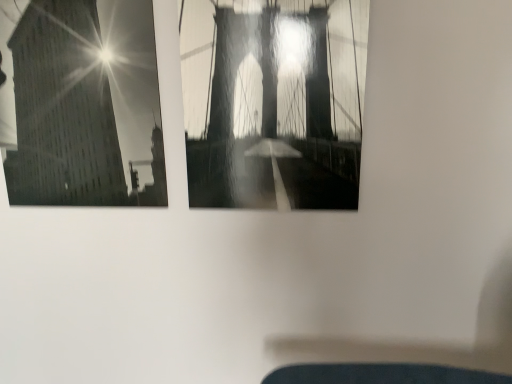
This screenshot has width=512, height=384. What do you see at coordinates (273, 102) in the screenshot? I see `metallic bridge at center, the second window in the left-to-right sequence` at bounding box center [273, 102].

Based on the photo, measure the distance between point (272, 197) and camera.

Point (272, 197) and camera are 95.60 centimeters apart.

Identify the location of metallic bridge at center, marked as the 1th window in a right-to-left arrangement. The height and width of the screenshot is (384, 512). (273, 102).

The height and width of the screenshot is (384, 512). What are the coordinates of `smooth glass building at upper left, the 1th window in the left-to-right sequence` in the screenshot? It's located at (86, 106).

Measure the distance between smooth glass building at upper left, which appears as the second window when viewed from the right, and camera.

34.37 inches.

How much space does smooth glass building at upper left, the 1th window in the left-to-right sequence, occupy horizontally?

The width of smooth glass building at upper left, the 1th window in the left-to-right sequence, is 2.05 inches.

What do you see at coordinates (86, 106) in the screenshot?
I see `smooth glass building at upper left, the 1th window in the left-to-right sequence` at bounding box center [86, 106].

At what (x,y) coordinates should I click in order to perform the action: click on metallic bridge at center, marked as the 1th window in a right-to-left arrangement. Please return your answer as a coordinate pair (x, y). The height and width of the screenshot is (384, 512). Looking at the image, I should click on (273, 102).

Based on the photo, which object is positioned more to the left, smooth glass building at upper left, which appears as the second window when viewed from the right, or metallic bridge at center, marked as the 1th window in a right-to-left arrangement?

smooth glass building at upper left, which appears as the second window when viewed from the right.

Is smooth glass building at upper left, the 1th window in the left-to-right sequence, closer to camera compared to metallic bridge at center, the second window in the left-to-right sequence?

No, it is behind metallic bridge at center, the second window in the left-to-right sequence.

Is point (116, 29) closer to camera compared to point (243, 135)?

Yes, point (116, 29) is in front of point (243, 135).

From the image's perspective, is smooth glass building at upper left, which appears as the second window when viewed from the right, on top of metallic bridge at center, the second window in the left-to-right sequence?

Yes, from the image's perspective, smooth glass building at upper left, which appears as the second window when viewed from the right, is on top of metallic bridge at center, the second window in the left-to-right sequence.

From a real-world perspective, is smooth glass building at upper left, which appears as the second window when viewed from the right, positioned above or below metallic bridge at center, marked as the 1th window in a right-to-left arrangement?

From a real-world perspective, smooth glass building at upper left, which appears as the second window when viewed from the right, is physically above metallic bridge at center, marked as the 1th window in a right-to-left arrangement.

Does smooth glass building at upper left, which appears as the second window when viewed from the right, have a lesser width compared to metallic bridge at center, the second window in the left-to-right sequence?

Yes.

Considering the relative sizes of smooth glass building at upper left, the 1th window in the left-to-right sequence, and metallic bridge at center, the second window in the left-to-right sequence, in the image provided, is smooth glass building at upper left, the 1th window in the left-to-right sequence, taller than metallic bridge at center, the second window in the left-to-right sequence,?

Yes.

Which of these two, smooth glass building at upper left, which appears as the second window when viewed from the right, or metallic bridge at center, marked as the 1th window in a right-to-left arrangement, is bigger?

smooth glass building at upper left, which appears as the second window when viewed from the right.

Based on the photo, is metallic bridge at center, the second window in the left-to-right sequence, completely or partially inside smooth glass building at upper left, which appears as the second window when viewed from the right?

Definitely not — metallic bridge at center, the second window in the left-to-right sequence, is not inside smooth glass building at upper left, which appears as the second window when viewed from the right.

Is smooth glass building at upper left, which appears as the second window when viewed from the right, in contact with metallic bridge at center, the second window in the left-to-right sequence?

No, smooth glass building at upper left, which appears as the second window when viewed from the right, is not touching metallic bridge at center, the second window in the left-to-right sequence.

Is smooth glass building at upper left, the 1th window in the left-to-right sequence, turned away from metallic bridge at center, the second window in the left-to-right sequence?

That's not correct — smooth glass building at upper left, the 1th window in the left-to-right sequence, is not looking away from metallic bridge at center, the second window in the left-to-right sequence.

Can you tell me how much smooth glass building at upper left, which appears as the second window when viewed from the right, and metallic bridge at center, marked as the 1th window in a right-to-left arrangement, differ in facing direction?

0.00226 degrees separate the facing orientations of smooth glass building at upper left, which appears as the second window when viewed from the right, and metallic bridge at center, marked as the 1th window in a right-to-left arrangement.

The height and width of the screenshot is (384, 512). Find the location of `window above the metallic bridge at center, marked as the 1th window in a right-to-left arrangement (from the image's perspective)`. window above the metallic bridge at center, marked as the 1th window in a right-to-left arrangement (from the image's perspective) is located at coordinates (86, 106).

Can you confirm if metallic bridge at center, the second window in the left-to-right sequence, is positioned to the left of smooth glass building at upper left, the 1th window in the left-to-right sequence?

Incorrect, metallic bridge at center, the second window in the left-to-right sequence, is not on the left side of smooth glass building at upper left, the 1th window in the left-to-right sequence.

Is the depth of metallic bridge at center, the second window in the left-to-right sequence, less than that of smooth glass building at upper left, which appears as the second window when viewed from the right?

Yes, it is.

Is point (352, 136) farther from camera compared to point (159, 159)?

No, (352, 136) is in front of (159, 159).

From the image's perspective, between metallic bridge at center, marked as the 1th window in a right-to-left arrangement, and smooth glass building at upper left, which appears as the second window when viewed from the right, which one is located above?

From the image's view, smooth glass building at upper left, which appears as the second window when viewed from the right, is above.

Based on the photo, from a real-world perspective, is metallic bridge at center, the second window in the left-to-right sequence, positioned above or below smooth glass building at upper left, which appears as the second window when viewed from the right?

metallic bridge at center, the second window in the left-to-right sequence, is below smooth glass building at upper left, which appears as the second window when viewed from the right.

Does metallic bridge at center, marked as the 1th window in a right-to-left arrangement, have a greater width compared to smooth glass building at upper left, the 1th window in the left-to-right sequence?

Yes, metallic bridge at center, marked as the 1th window in a right-to-left arrangement, is wider than smooth glass building at upper left, the 1th window in the left-to-right sequence.

Is metallic bridge at center, marked as the 1th window in a right-to-left arrangement, shorter than smooth glass building at upper left, the 1th window in the left-to-right sequence?

Yes, metallic bridge at center, marked as the 1th window in a right-to-left arrangement, is shorter than smooth glass building at upper left, the 1th window in the left-to-right sequence.

Considering the sizes of objects metallic bridge at center, the second window in the left-to-right sequence, and smooth glass building at upper left, the 1th window in the left-to-right sequence, in the image provided, who is smaller, metallic bridge at center, the second window in the left-to-right sequence, or smooth glass building at upper left, the 1th window in the left-to-right sequence,?

metallic bridge at center, the second window in the left-to-right sequence.

From the picture: Can we say metallic bridge at center, marked as the 1th window in a right-to-left arrangement, lies outside smooth glass building at upper left, the 1th window in the left-to-right sequence?

metallic bridge at center, marked as the 1th window in a right-to-left arrangement, is positioned outside smooth glass building at upper left, the 1th window in the left-to-right sequence.

Would you consider metallic bridge at center, the second window in the left-to-right sequence, to be distant from smooth glass building at upper left, the 1th window in the left-to-right sequence?

No.

Is metallic bridge at center, marked as the 1th window in a right-to-left arrangement, turned away from smooth glass building at upper left, the 1th window in the left-to-right sequence?

metallic bridge at center, marked as the 1th window in a right-to-left arrangement, is not turned away from smooth glass building at upper left, the 1th window in the left-to-right sequence.

Measure the distance between metallic bridge at center, the second window in the left-to-right sequence, and smooth glass building at upper left, the 1th window in the left-to-right sequence.

24.28 centimeters.

At what (x,y) coordinates should I click in order to perform the action: click on window positioned vertically above the metallic bridge at center, marked as the 1th window in a right-to-left arrangement (from a real-world perspective). Please return your answer as a coordinate pair (x, y). The width and height of the screenshot is (512, 384). Looking at the image, I should click on (86, 106).

Locate an element on the screen. window on the right of the smooth glass building at upper left, the 1th window in the left-to-right sequence is located at coordinates (273, 102).

Locate an element on the screen. window in front of the smooth glass building at upper left, the 1th window in the left-to-right sequence is located at coordinates (273, 102).